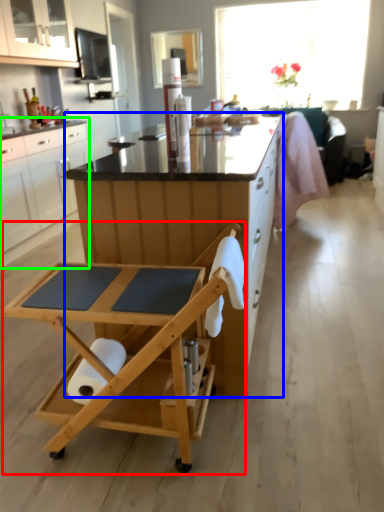
Question: Which object is the closest to the table (highlighted by a red box)? Choose among these: desk (highlighted by a blue box) or cabinetry (highlighted by a green box).

Choices:
 (A) desk
 (B) cabinetry

Answer: (A)